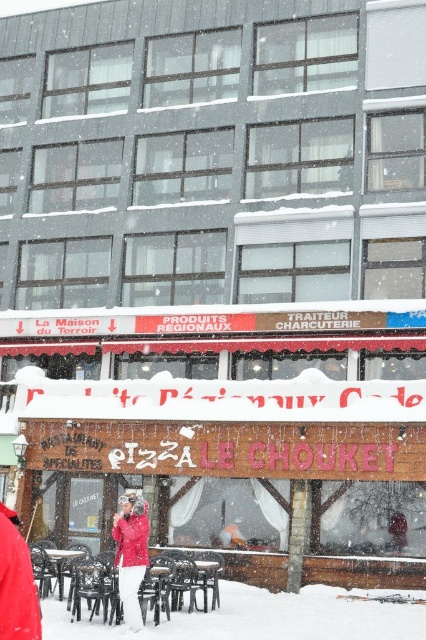
You are standing in front of the restaurant and see the white powdery snow at lower center and the matte red jacket at center. Which object is located to the right of the other?

The white powdery snow at lower center is located to the right of the matte red jacket at center.

You are standing at the entrance of the restaurant and want to walk to the point marked by point (409, 621). However, there is an obstacle at point (143, 563). Will you be able to see the obstacle from your current position?

Since point (409, 621) is behind point (143, 563), the obstacle at point (143, 563) will block your view of the target point. Therefore, you cannot see the obstacle from your current position.